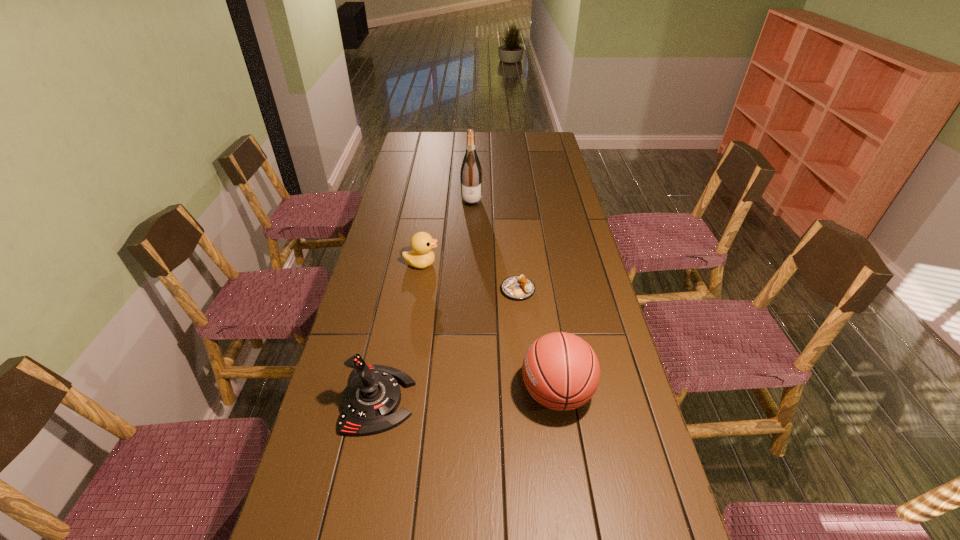
Locate an element on the screen. The width and height of the screenshot is (960, 540). object that can be found as the second closest to the basketball is located at coordinates (370, 400).

The height and width of the screenshot is (540, 960). I want to click on free location that satisfies the following two spatial constraints: 1. on the face of the fourth nearest object; 2. on the back side of the third nearest object, so point(418,290).

Where is `free point that satisfies the following two spatial constraints: 1. on the label of the tallest object; 2. on the handle side of the joystick`? This screenshot has width=960, height=540. free point that satisfies the following two spatial constraints: 1. on the label of the tallest object; 2. on the handle side of the joystick is located at coordinates (x=467, y=400).

This screenshot has height=540, width=960. I want to click on vacant space that satisfies the following two spatial constraints: 1. on the label of the third nearest object; 2. on the left side of the farthest object, so click(x=469, y=290).

The height and width of the screenshot is (540, 960). Identify the location of vacant space that satisfies the following two spatial constraints: 1. on the label of the wine bottle; 2. on the face of the fourth nearest object. [470, 264].

This screenshot has height=540, width=960. Find the location of `free location that satisfies the following two spatial constraints: 1. on the label of the third object from right to left; 2. on the handle side of the joystick`. free location that satisfies the following two spatial constraints: 1. on the label of the third object from right to left; 2. on the handle side of the joystick is located at coordinates (467, 400).